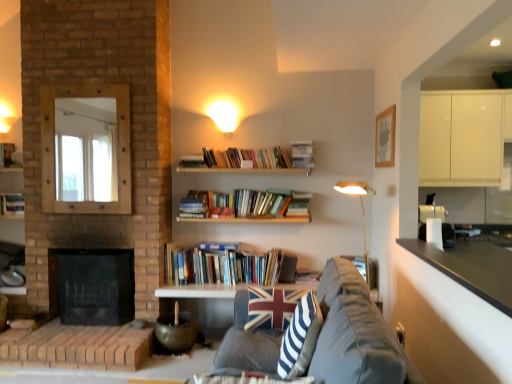
Question: Does hardcover books at center, the 3th book when ordered from top to bottom, have a larger size compared to matte white lampshade at upper center?

Choices:
 (A) no
 (B) yes

Answer: (B)

Question: From the image's perspective, would you say hardcover books at center, the 2th book when ordered from bottom to top, is shown under matte white lampshade at upper center?

Choices:
 (A) yes
 (B) no

Answer: (A)

Question: Are hardcover books at center, which appears as the second book when viewed from the left, and matte white lampshade at upper center beside each other?

Choices:
 (A) no
 (B) yes

Answer: (A)

Question: Can you confirm if hardcover books at center, which appears as the second book when viewed from the left, is shorter than matte white lampshade at upper center?

Choices:
 (A) no
 (B) yes

Answer: (A)

Question: From a real-world perspective, is hardcover books at center, which appears as the second book when viewed from the left, positioned over matte white lampshade at upper center based on gravity?

Choices:
 (A) yes
 (B) no

Answer: (B)

Question: From a real-world perspective, is hardcover books at center, which is the third book from right to left, located beneath matte white lampshade at upper center?

Choices:
 (A) no
 (B) yes

Answer: (B)

Question: Is hardcover books at center, which appears as the second book when viewed from the left, to the left of blue and white striped fabric pillow at center from the viewer's perspective?

Choices:
 (A) no
 (B) yes

Answer: (B)

Question: Is hardcover books at center, which is the third book from right to left, turned away from blue and white striped fabric pillow at center?

Choices:
 (A) yes
 (B) no

Answer: (B)

Question: From a real-world perspective, is hardcover books at center, the 3th book when ordered from top to bottom, under blue and white striped fabric pillow at center?

Choices:
 (A) no
 (B) yes

Answer: (A)

Question: Is hardcover books at center, the 2th book when ordered from bottom to top, facing towards blue and white striped fabric pillow at center?

Choices:
 (A) yes
 (B) no

Answer: (A)

Question: Is hardcover books at center, the 3th book when ordered from top to bottom, taller than blue and white striped fabric pillow at center?

Choices:
 (A) no
 (B) yes

Answer: (A)

Question: Can you confirm if hardcover books at center, which appears as the second book when viewed from the left, is smaller than blue and white striped fabric pillow at center?

Choices:
 (A) no
 (B) yes

Answer: (A)

Question: Would you say matte white lampshade at upper center is a long distance from union jack fabric pillow at center?

Choices:
 (A) no
 (B) yes

Answer: (B)